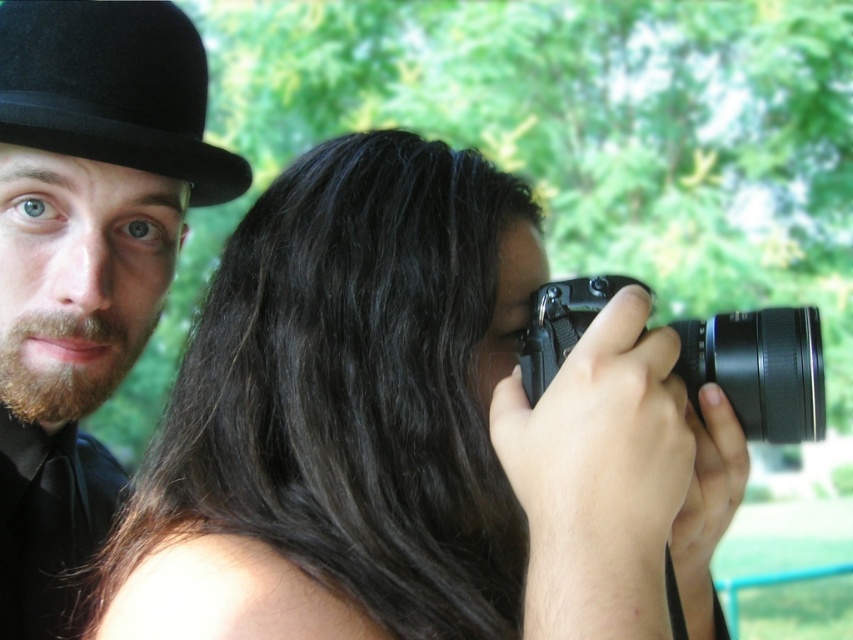
Question: Which point appears farthest from the camera in this image?

Choices:
 (A) (109, 621)
 (B) (202, 195)
 (C) (743, 380)

Answer: (B)

Question: Which object is positioned farthest from the black plastic camera at center?

Choices:
 (A) smooth black camera at center
 (B) black matte bowler hat at upper left
 (C) black felt bowler hat at upper left

Answer: (B)

Question: Is black matte bowler hat at upper left to the right of black plastic camera at center from the viewer's perspective?

Choices:
 (A) yes
 (B) no

Answer: (B)

Question: Is smooth black camera at center bigger than black plastic camera at center?

Choices:
 (A) no
 (B) yes

Answer: (B)

Question: Considering the real-world distances, which object is closest to the black plastic camera at center?

Choices:
 (A) smooth black camera at center
 (B) black felt bowler hat at upper left
 (C) black matte bowler hat at upper left

Answer: (A)

Question: Where is black felt bowler hat at upper left located in relation to black plastic camera at center in the image?

Choices:
 (A) above
 (B) below

Answer: (A)